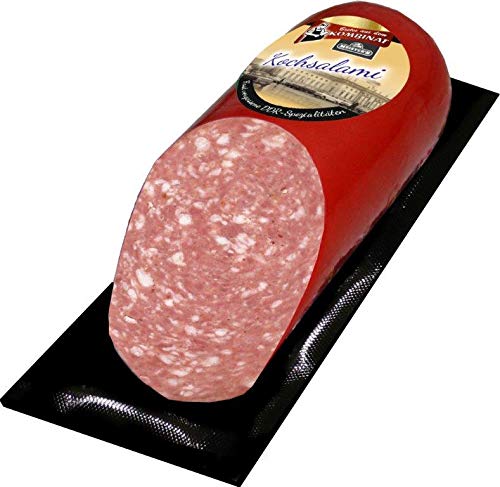
Where is `1 black apron`? This screenshot has width=500, height=487. 1 black apron is located at coordinates (307, 39).